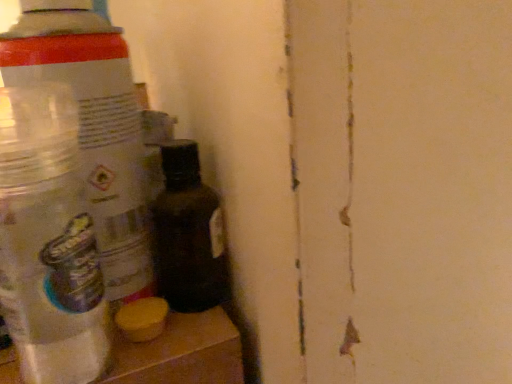
The height and width of the screenshot is (384, 512). What do you see at coordinates (93, 125) in the screenshot? I see `transparent plastic bottle at left` at bounding box center [93, 125].

In order to face transparent plastic bottle at left, should I rotate leftwards or rightwards?

Rotate left and turn 19.070 degrees.

Locate an element on the screen. The image size is (512, 384). transparent plastic bottle at left is located at coordinates (93, 125).

At what (x,y) coordinates should I click in order to perform the action: click on transparent plastic bottle at left. Please return your answer as a coordinate pair (x, y). The image size is (512, 384). Looking at the image, I should click on (93, 125).